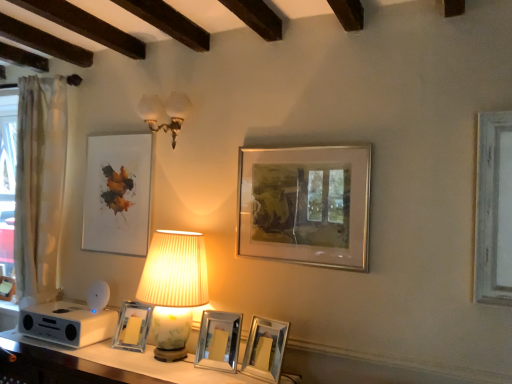
Locate an element on the screen. unoccupied area in front of clear glass photo frame at center, the second picture frame from the left is located at coordinates (124, 358).